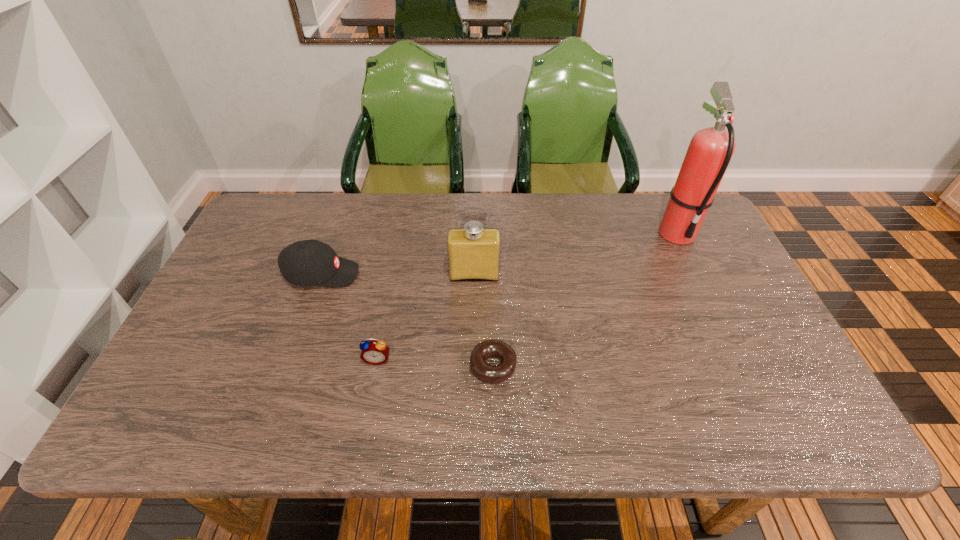
Where is `free spot between the farthest object and the fourth tallest object`? free spot between the farthest object and the fourth tallest object is located at coordinates (527, 296).

Find the location of `object that is the fourth closest to the third tallest object`. object that is the fourth closest to the third tallest object is located at coordinates (709, 153).

At what (x,y) coordinates should I click in order to perform the action: click on the third closest object relative to the rightmost object. Please return your answer as a coordinate pair (x, y). Looking at the image, I should click on (373, 352).

The height and width of the screenshot is (540, 960). In order to click on vacant region that satisfies the following two spatial constraints: 1. on the front-facing side of the doughnut; 2. on the right side of the alarm clock in this screenshot , I will do `click(376, 366)`.

This screenshot has width=960, height=540. In order to click on vacant space that satisfies the following two spatial constraints: 1. on the front-facing side of the doughnut; 2. on the right side of the fourth shortest object in this screenshot , I will do `click(473, 366)`.

The image size is (960, 540). I want to click on vacant point that satisfies the following two spatial constraints: 1. on the front-facing side of the doughnut; 2. on the left side of the alarm clock, so click(376, 366).

Identify the location of vacant region that satisfies the following two spatial constraints: 1. on the front-facing side of the shortest object; 2. on the right side of the fourth shortest object. pyautogui.click(x=473, y=366).